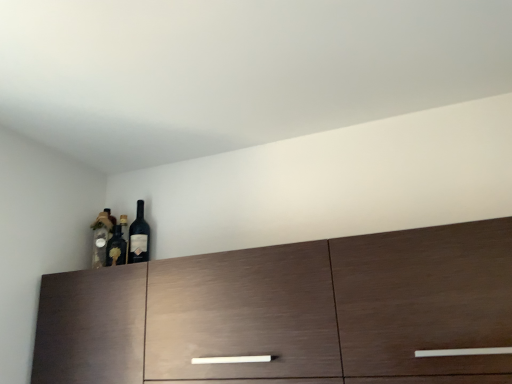
Describe the element at coordinates (289, 312) in the screenshot. The height and width of the screenshot is (384, 512). I see `dark wood cabinet at center` at that location.

At what (x,y) coordinates should I click in order to perform the action: click on matte glass wine bottle at upper left. Please return your answer as a coordinate pair (x, y). Looking at the image, I should click on (139, 237).

This screenshot has height=384, width=512. I want to click on cabinetry in front of the matte glass bottle at left, so click(x=289, y=312).

Is matte glass bottle at left aimed at dark wood cabinet at center?

No, matte glass bottle at left is not facing towards dark wood cabinet at center.

Can you tell me how much matte glass bottle at left and dark wood cabinet at center differ in facing direction?

They differ by 35.1 degrees in their facing directions.

Measure the distance between matte glass bottle at left and dark wood cabinet at center.

matte glass bottle at left and dark wood cabinet at center are 65.50 centimeters apart from each other.

Is dark wood cabinet at center oriented away from matte glass bottle at left?

dark wood cabinet at center does not have its back to matte glass bottle at left.

From a real-world perspective, is dark wood cabinet at center below matte glass bottle at left?

Yes, from a real-world perspective, dark wood cabinet at center is below matte glass bottle at left.

Between dark wood cabinet at center and matte glass bottle at left, which one has more height?

Standing taller between the two is dark wood cabinet at center.

Is matte glass bottle at left in front of matte glass wine bottle at upper left?

No, the depth of matte glass bottle at left is greater than that of matte glass wine bottle at upper left.

Is matte glass bottle at left aimed at matte glass wine bottle at upper left?

No, matte glass bottle at left is not oriented towards matte glass wine bottle at upper left.

Are matte glass wine bottle at upper left and dark wood cabinet at center making contact?

No, matte glass wine bottle at upper left is not beside dark wood cabinet at center.

From their relative heights in the image, would you say matte glass wine bottle at upper left is taller or shorter than dark wood cabinet at center?

In the image, matte glass wine bottle at upper left appears to be shorter than dark wood cabinet at center.

Looking at this image, from a real-world perspective, is matte glass wine bottle at upper left under dark wood cabinet at center?

No, from a real-world perspective, matte glass wine bottle at upper left is not under dark wood cabinet at center.

Between matte glass wine bottle at upper left and matte glass bottle at left, which one has larger width?

Wider between the two is matte glass bottle at left.

Does matte glass wine bottle at upper left have a greater height compared to matte glass bottle at left?

Indeed, matte glass wine bottle at upper left has a greater height compared to matte glass bottle at left.

Is matte glass wine bottle at upper left far from matte glass bottle at left?

matte glass wine bottle at upper left is near matte glass bottle at left, not far away.

Considering their positions, is matte glass wine bottle at upper left located in front of or behind matte glass bottle at left?

matte glass wine bottle at upper left is positioned closer to the viewer than matte glass bottle at left.

From a real-world perspective, who is located lower, dark wood cabinet at center or matte glass wine bottle at upper left?

dark wood cabinet at center is physically lower.

Which of these two, dark wood cabinet at center or matte glass wine bottle at upper left, stands taller?

dark wood cabinet at center.

Can you confirm if dark wood cabinet at center is thinner than matte glass wine bottle at upper left?

No.

How different are the orientations of dark wood cabinet at center and matte glass wine bottle at upper left in degrees?

dark wood cabinet at center and matte glass wine bottle at upper left are facing 0.188 degrees away from each other.

The width and height of the screenshot is (512, 384). What are the coordinates of `bottle that is above the dark wood cabinet at center (from a real-world perspective)` in the screenshot? It's located at (102, 236).

Find the location of `cabinetry below the matte glass bottle at left (from the image's perspective)`. cabinetry below the matte glass bottle at left (from the image's perspective) is located at coordinates (289, 312).

Based on their spatial positions, is dark wood cabinet at center or matte glass bottle at left further from matte glass wine bottle at upper left?

The object further to matte glass wine bottle at upper left is dark wood cabinet at center.

Based on the photo, based on their spatial positions, is matte glass wine bottle at upper left or dark wood cabinet at center further from matte glass bottle at left?

dark wood cabinet at center is further to matte glass bottle at left.

Which object lies nearer to the anchor point dark wood cabinet at center, matte glass bottle at left or matte glass wine bottle at upper left?

Based on the image, matte glass wine bottle at upper left appears to be nearer to dark wood cabinet at center.

Which object lies nearer to the anchor point dark wood cabinet at center, matte glass wine bottle at upper left or matte glass bottle at left?

matte glass wine bottle at upper left is positioned closer to the anchor dark wood cabinet at center.

From the image, which object appears to be nearer to matte glass wine bottle at upper left, matte glass bottle at left or dark wood cabinet at center?

matte glass bottle at left lies closer to matte glass wine bottle at upper left than the other object.

Looking at this image, estimate the real-world distances between objects in this image. Which object is further from matte glass bottle at left, dark wood cabinet at center or matte glass wine bottle at upper left?

dark wood cabinet at center is further to matte glass bottle at left.

This screenshot has width=512, height=384. What are the coordinates of `wine bottle between dark wood cabinet at center and matte glass bottle at left along the z-axis` in the screenshot? It's located at (139, 237).